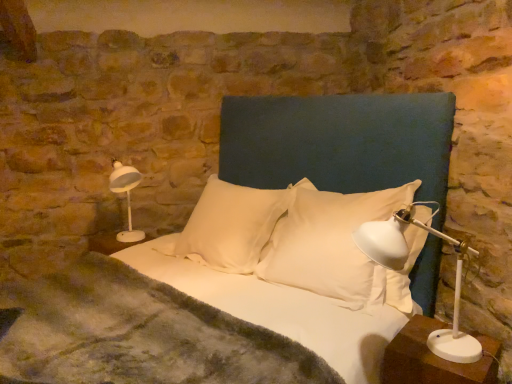
At what (x,y) coordinates should I click in order to perform the action: click on empty space that is ontop of white plastic nightstand at lower right (from a real-world perspective). Please return your answer as a coordinate pair (x, y). Image resolution: width=512 pixels, height=384 pixels. Looking at the image, I should click on (430, 354).